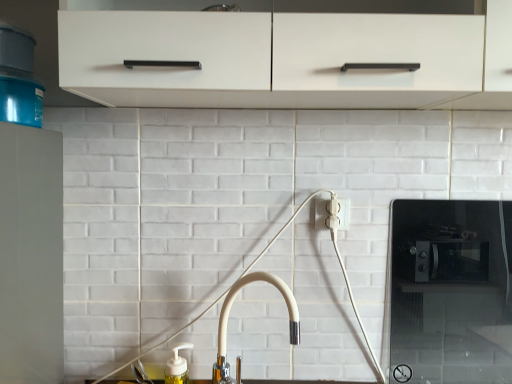
Question: In the image, is cream matte faucet at center on the left side or the right side of black glass microwave at right?

Choices:
 (A) left
 (B) right

Answer: (A)

Question: Is point (228, 299) positioned closer to the camera than point (423, 220)?

Choices:
 (A) closer
 (B) farther

Answer: (A)

Question: Is cream matte faucet at center taller or shorter than black glass microwave at right?

Choices:
 (A) tall
 (B) short

Answer: (B)

Question: From a real-world perspective, is black glass microwave at right positioned above or below cream matte faucet at center?

Choices:
 (A) below
 (B) above

Answer: (B)

Question: Relative to cream matte faucet at center, is black glass microwave at right in front or behind?

Choices:
 (A) front
 (B) behind

Answer: (B)

Question: Is black glass microwave at right bigger or smaller than cream matte faucet at center?

Choices:
 (A) big
 (B) small

Answer: (B)

Question: From the image's perspective, is black glass microwave at right positioned above or below cream matte faucet at center?

Choices:
 (A) below
 (B) above

Answer: (B)